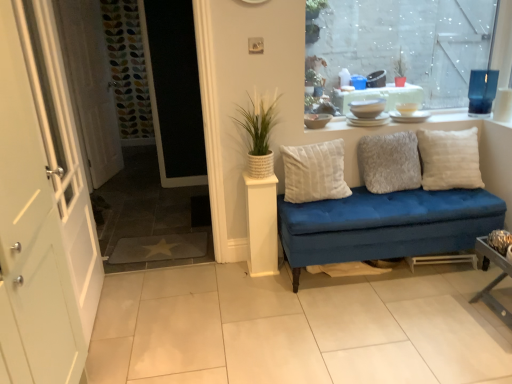
This screenshot has height=384, width=512. I want to click on free space between metallic silver table at lower right, which ranks as the second table in back-to-front order, and white matte pedestal at center, marked as the first table in a left-to-right arrangement, so click(396, 293).